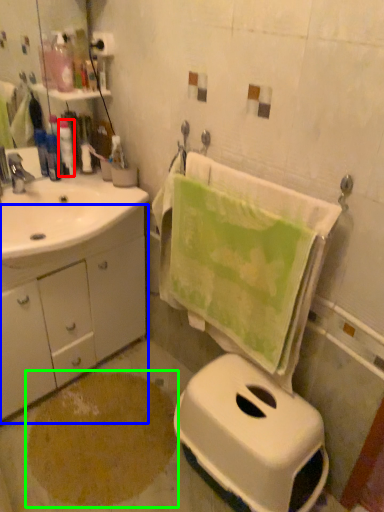
Question: Estimate the real-world distances between objects in this image. Which object is farther from toiletry (highlighted by a red box), bathroom cabinet (highlighted by a blue box) or powder (highlighted by a green box)?

Choices:
 (A) bathroom cabinet
 (B) powder

Answer: (B)